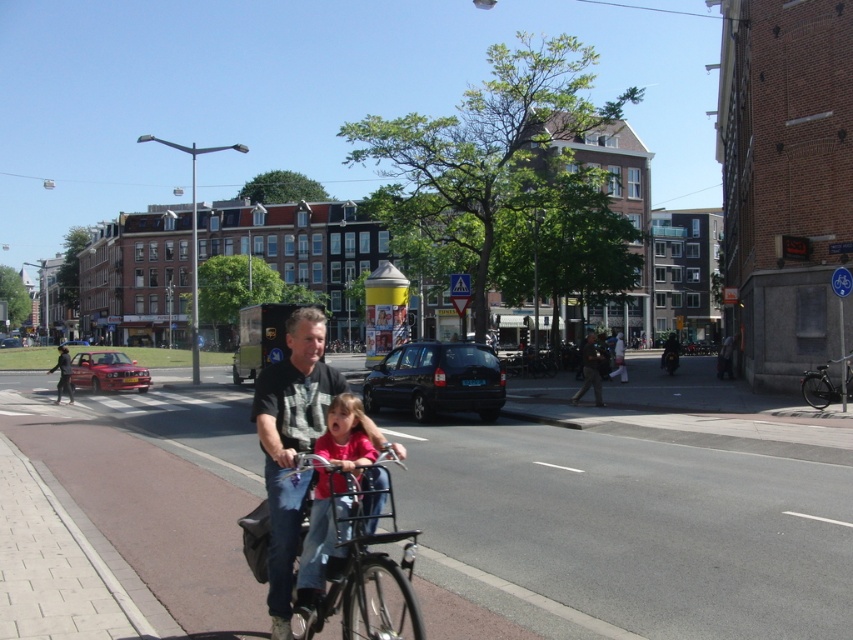
Is black rubber bike lane at lower left to the right of dark gray jacket at center from the viewer's perspective?

Incorrect, black rubber bike lane at lower left is not on the right side of dark gray jacket at center.

Is black rubber bike lane at lower left to the left of dark gray jacket at center from the viewer's perspective?

Indeed, black rubber bike lane at lower left is positioned on the left side of dark gray jacket at center.

Between point (553, 452) and point (584, 369), which one is positioned in front?

Point (553, 452) is more forward.

Find the location of `black rubber bike lane at lower left`. black rubber bike lane at lower left is located at coordinates (630, 528).

Can you confirm if dark gray t-shirt at center is bigger than dark gray jacket at center?

No.

Which is more to the right, dark gray t-shirt at center or dark gray jacket at center?

From the viewer's perspective, dark gray jacket at center appears more on the right side.

Image resolution: width=853 pixels, height=640 pixels. I want to click on dark gray t-shirt at center, so click(x=291, y=444).

Image resolution: width=853 pixels, height=640 pixels. What are the coordinates of `dark gray t-shirt at center` in the screenshot? It's located at (291, 444).

Can you confirm if black rubber bike lane at lower left is thinner than black matte bicycle at right?

No, black rubber bike lane at lower left is not thinner than black matte bicycle at right.

Who is more distant from viewer, (801,448) or (851,380)?

The point (851,380) is behind.

Image resolution: width=853 pixels, height=640 pixels. Find the location of `black rubber bike lane at lower left`. black rubber bike lane at lower left is located at coordinates (630, 528).